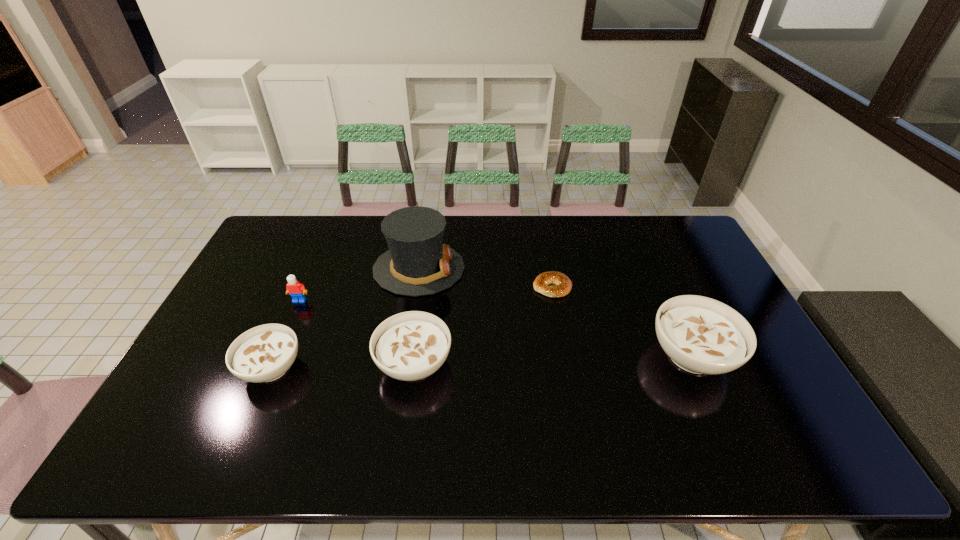
You are a GUI agent. You are given a task and a screenshot of the screen. Output one action in this format:
    pyautogui.click(x=<x>, y=<y>)
    Task: Click on the vacant area at the near edge of the desktop
    The height and width of the screenshot is (540, 960).
    Given the screenshot: What is the action you would take?
    pyautogui.click(x=647, y=420)

Locate an element on the screen. vacant space at the left edge of the desktop is located at coordinates (286, 283).

This screenshot has width=960, height=540. Find the location of `free space at the far left corner of the desktop`. free space at the far left corner of the desktop is located at coordinates (315, 218).

The image size is (960, 540). Find the location of `free location at the far right corner of the desktop`. free location at the far right corner of the desktop is located at coordinates (695, 246).

Where is `vacant area that lies between the rightmost soup bowl and the bagel`? vacant area that lies between the rightmost soup bowl and the bagel is located at coordinates coord(622,321).

The width and height of the screenshot is (960, 540). What are the coordinates of `vacant point located between the second object from right to left and the rightmost soup bowl` in the screenshot? It's located at (622, 321).

At what (x,y) coordinates should I click in order to perform the action: click on vacant region between the dress hat and the Lego. Please return your answer as a coordinate pair (x, y). Looking at the image, I should click on (359, 285).

Locate an element on the screen. Image resolution: width=960 pixels, height=540 pixels. vacant area between the dress hat and the fifth tallest object is located at coordinates click(346, 318).

The image size is (960, 540). Find the location of `vacant region between the tallest object and the rightmost object`. vacant region between the tallest object and the rightmost object is located at coordinates (556, 312).

The image size is (960, 540). I want to click on free spot between the second shortest soup bowl and the rightmost object, so click(x=553, y=359).